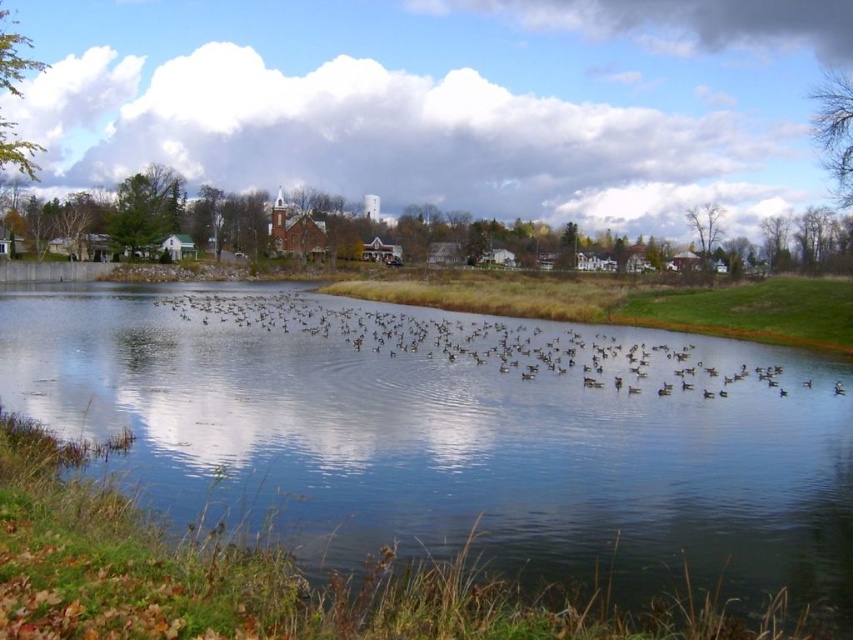
Does clear water at center have a greater height compared to brown matte birds at center?

In fact, clear water at center may be shorter than brown matte birds at center.

This screenshot has width=853, height=640. Identify the location of clear water at center. (457, 440).

The image size is (853, 640). In order to click on clear water at center in this screenshot , I will do click(x=457, y=440).